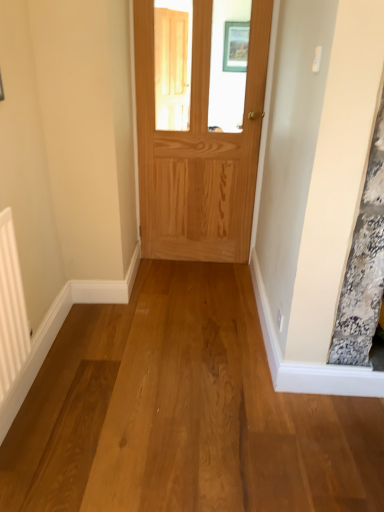
Image resolution: width=384 pixels, height=512 pixels. Identify the location of free region under white textured radiator at left (from a real-world perspective). (24, 430).